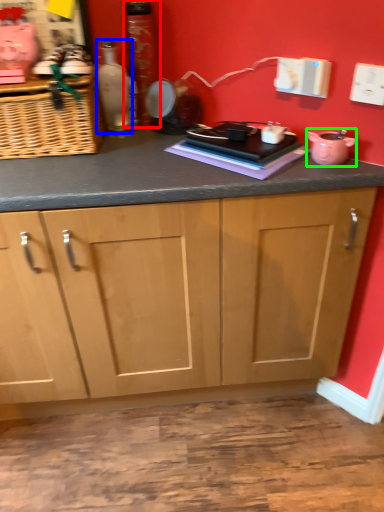
Question: Which object is the closest to the bottle (highlighted by a red box)? Choose among these: bottle (highlighted by a blue box) or appliance (highlighted by a green box).

Choices:
 (A) bottle
 (B) appliance

Answer: (A)